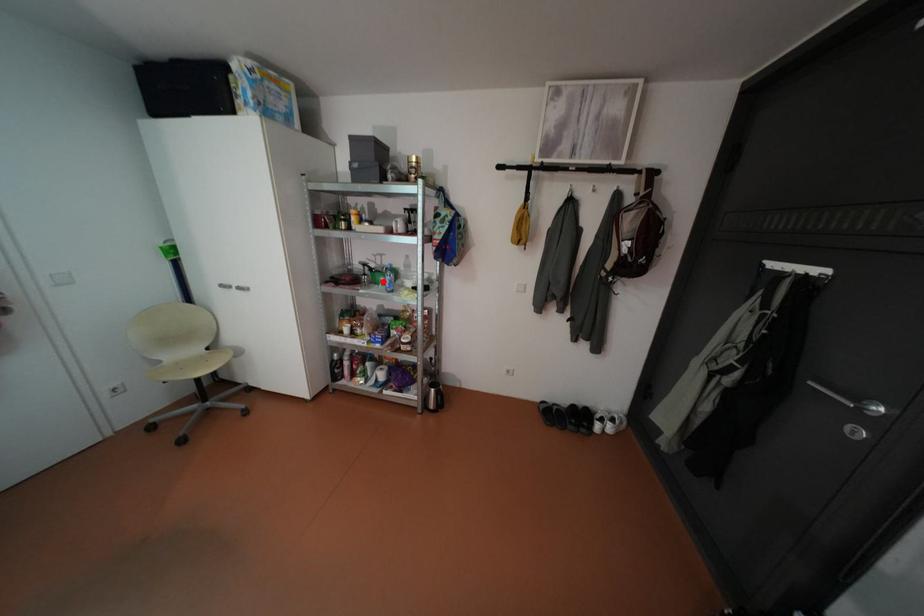
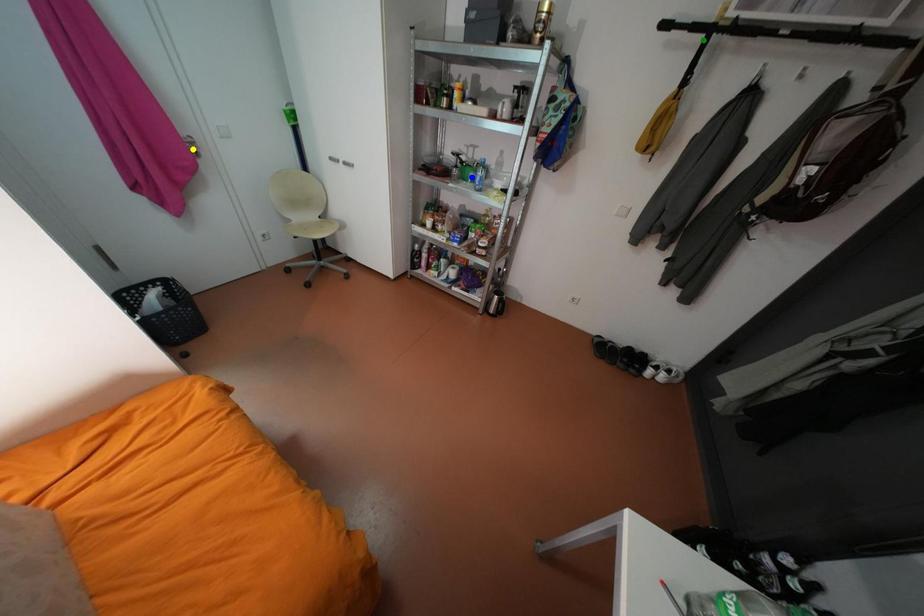
Question: I am providing you with two images of the same scene from different viewpoints. A red point is marked on the first image. You are given multiple points on the second image. Which mark in image 2 goes with the point in image 1?

Choices:
 (A) yellow point
 (B) blue point
 (C) green point

Answer: (B)